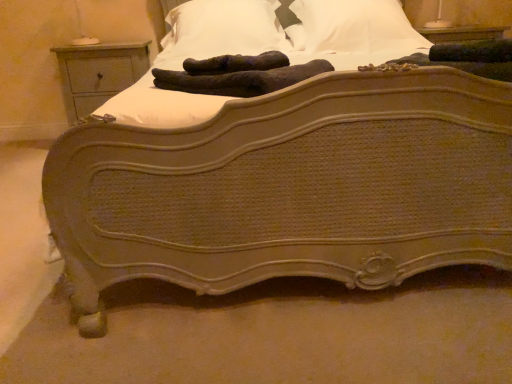
Question: From the image's perspective, is light gray wood nightstand at left on white soft pillow at upper center, which ranks as the second pillow in left-to-right order?

Choices:
 (A) no
 (B) yes

Answer: (A)

Question: Can you confirm if light gray wood nightstand at left is bigger than white soft pillow at upper center, which ranks as the second pillow in left-to-right order?

Choices:
 (A) yes
 (B) no

Answer: (B)

Question: Is light gray wood nightstand at left facing towards white soft pillow at upper center, which ranks as the second pillow in left-to-right order?

Choices:
 (A) no
 (B) yes

Answer: (A)

Question: Can you confirm if light gray wood nightstand at left is taller than white soft pillow at upper center, which ranks as the second pillow in left-to-right order?

Choices:
 (A) no
 (B) yes

Answer: (B)

Question: Is light gray wood nightstand at left further to the viewer compared to white soft pillow at upper center, which ranks as the second pillow in left-to-right order?

Choices:
 (A) no
 (B) yes

Answer: (B)

Question: Is light gray wood nightstand at left to the right of white soft pillow at upper center, which ranks as the second pillow in left-to-right order, from the viewer's perspective?

Choices:
 (A) no
 (B) yes

Answer: (A)

Question: Is brown fuzzy gloves at center turned away from white soft pillow at upper center, the first pillow positioned from the right?

Choices:
 (A) no
 (B) yes

Answer: (B)

Question: Considering the relative positions of brown fuzzy gloves at center and white soft pillow at upper center, which ranks as the second pillow in left-to-right order, in the image provided, is brown fuzzy gloves at center to the right of white soft pillow at upper center, which ranks as the second pillow in left-to-right order, from the viewer's perspective?

Choices:
 (A) yes
 (B) no

Answer: (B)

Question: Considering the relative sizes of brown fuzzy gloves at center and white soft pillow at upper center, the first pillow positioned from the right, in the image provided, is brown fuzzy gloves at center bigger than white soft pillow at upper center, the first pillow positioned from the right,?

Choices:
 (A) yes
 (B) no

Answer: (B)

Question: Is brown fuzzy gloves at center behind white soft pillow at upper center, the first pillow positioned from the right?

Choices:
 (A) yes
 (B) no

Answer: (B)

Question: From a real-world perspective, is brown fuzzy gloves at center physically above white soft pillow at upper center, which ranks as the second pillow in left-to-right order?

Choices:
 (A) no
 (B) yes

Answer: (A)

Question: Are brown fuzzy gloves at center and white soft pillow at upper center, the first pillow positioned from the right, far apart?

Choices:
 (A) no
 (B) yes

Answer: (B)

Question: From a real-world perspective, is brown fuzzy gloves at center on light gray wood nightstand at left?

Choices:
 (A) no
 (B) yes

Answer: (B)